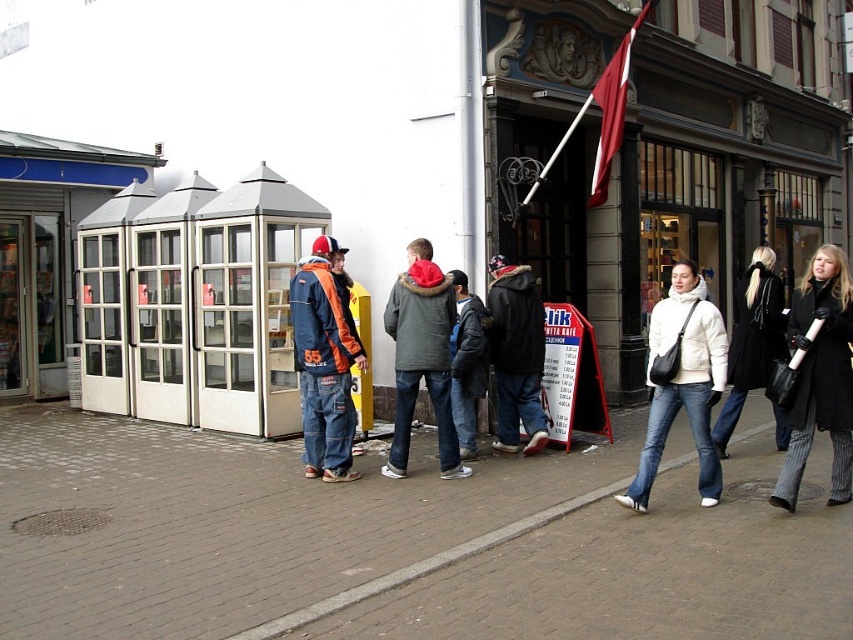
Is point (743, 324) farther from camera compared to point (466, 445)?

Yes, it is behind point (466, 445).

At what (x,y) coordinates should I click in order to perform the action: click on black leather coat at right. Please return your answer as a coordinate pair (x, y). This screenshot has width=853, height=640. Looking at the image, I should click on (751, 339).

Where is `black leather coat at right`? The height and width of the screenshot is (640, 853). black leather coat at right is located at coordinates (751, 339).

Is red flag at upper center below black leather coat at right?

No, red flag at upper center is not below black leather coat at right.

Is red flag at upper center shorter than black leather coat at right?

Incorrect, red flag at upper center's height does not fall short of black leather coat at right's.

Does point (485, 70) lie in front of point (761, 292)?

No, (485, 70) is further to viewer.

This screenshot has height=640, width=853. What are the coordinates of `red flag at upper center` in the screenshot? It's located at (660, 148).

Image resolution: width=853 pixels, height=640 pixels. I want to click on striped wool coat at right, so [x=820, y=376].

Can you confirm if striped wool coat at right is positioned to the right of dark blue jeans at center?

Yes, striped wool coat at right is to the right of dark blue jeans at center.

Which is in front, point (785, 506) or point (520, 346)?

Point (785, 506) is more forward.

This screenshot has height=640, width=853. I want to click on striped wool coat at right, so point(820,376).